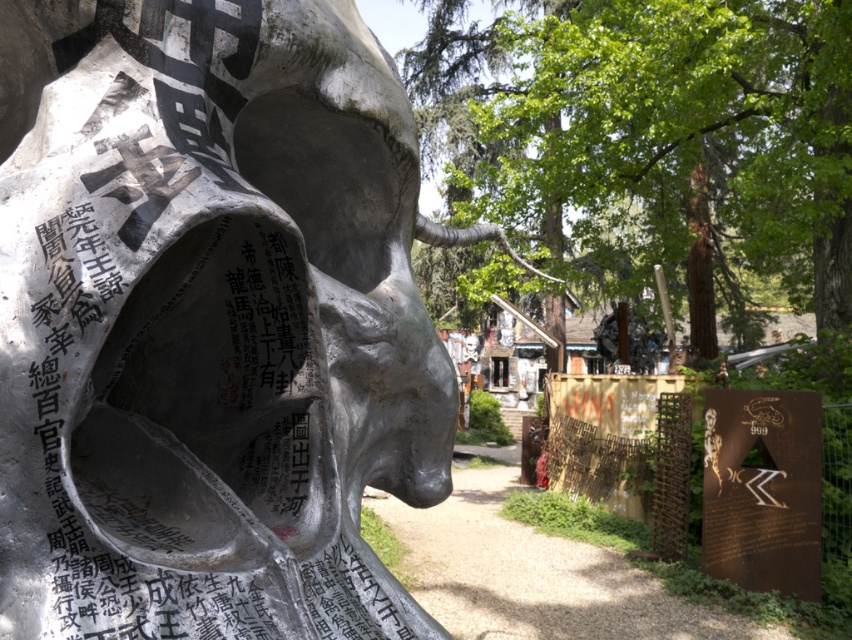
Who is positioned more to the right, polished silver skull at center or green leafy tree at center?

green leafy tree at center

Who is positioned more to the left, polished silver skull at center or green leafy tree at center?

Positioned to the left is polished silver skull at center.

Does point (354, 276) come farther from viewer compared to point (570, 104)?

No, (354, 276) is in front of (570, 104).

Where is `polished silver skull at center`? polished silver skull at center is located at coordinates click(209, 321).